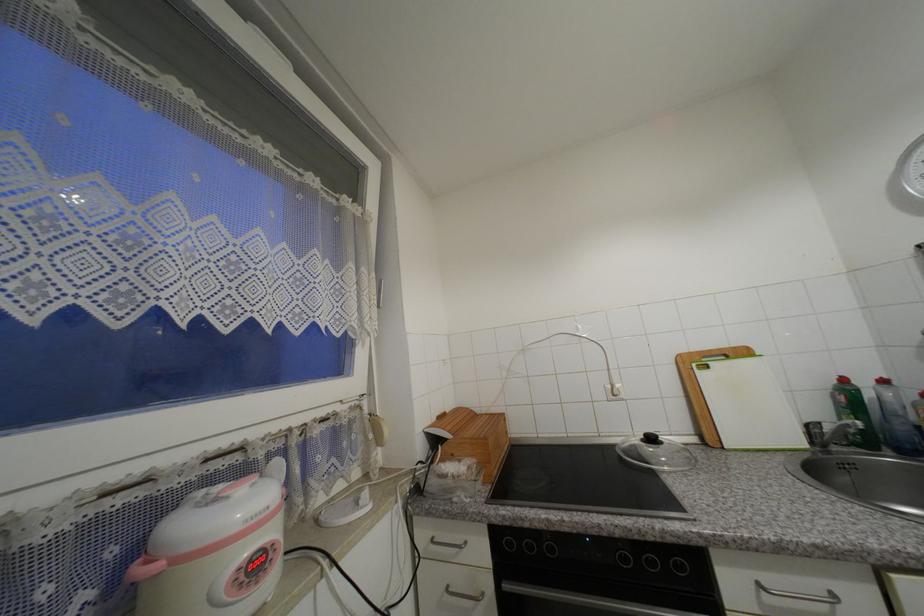
Find the location of a particular element. The width and height of the screenshot is (924, 616). white cutting board is located at coordinates pyautogui.click(x=748, y=405).